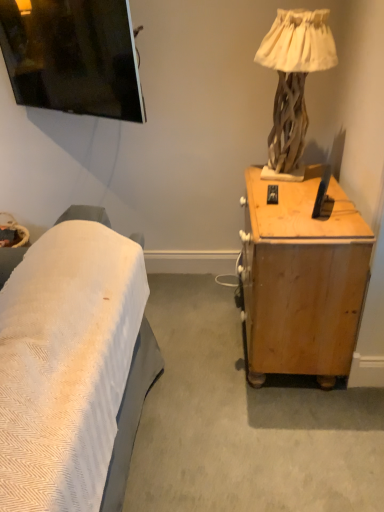
Question: Is wooden desk at right at the back of wooden textured lamp at upper right?

Choices:
 (A) yes
 (B) no

Answer: (B)

Question: Can you confirm if wooden textured lamp at upper right is positioned to the left of wooden desk at right?

Choices:
 (A) yes
 (B) no

Answer: (A)

Question: Are wooden textured lamp at upper right and wooden desk at right beside each other?

Choices:
 (A) no
 (B) yes

Answer: (A)

Question: From the image's perspective, is wooden textured lamp at upper right under wooden desk at right?

Choices:
 (A) yes
 (B) no

Answer: (B)

Question: Can you confirm if wooden textured lamp at upper right is smaller than wooden desk at right?

Choices:
 (A) no
 (B) yes

Answer: (B)

Question: Can you confirm if wooden textured lamp at upper right is thinner than wooden desk at right?

Choices:
 (A) yes
 (B) no

Answer: (A)

Question: Is wooden desk at right shorter than wooden textured lamp at upper right?

Choices:
 (A) no
 (B) yes

Answer: (A)

Question: Does wooden desk at right appear on the right side of wooden textured lamp at upper right?

Choices:
 (A) no
 (B) yes

Answer: (B)

Question: Is wooden desk at right closer to the viewer compared to wooden textured lamp at upper right?

Choices:
 (A) no
 (B) yes

Answer: (B)

Question: Is wooden desk at right positioned behind wooden textured lamp at upper right?

Choices:
 (A) yes
 (B) no

Answer: (B)

Question: Would you say wooden desk at right contains wooden textured lamp at upper right?

Choices:
 (A) no
 (B) yes

Answer: (A)

Question: Is wooden desk at right thinner than wooden textured lamp at upper right?

Choices:
 (A) yes
 (B) no

Answer: (B)

Question: From a real-world perspective, is wooden textured lamp at upper right physically located above or below wooden desk at right?

Choices:
 (A) below
 (B) above

Answer: (B)